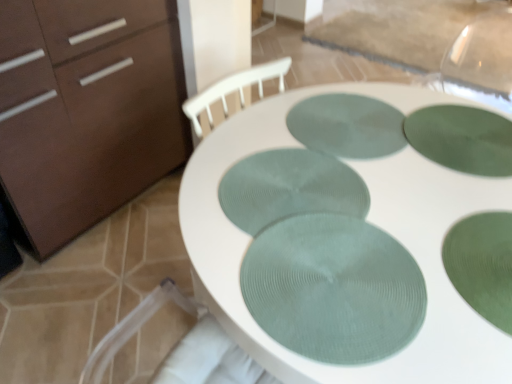
In order to click on free point below green textured glass plate at center, the first glass plate viewed from the front (from a real-world perspective) in this screenshot , I will do `click(349, 269)`.